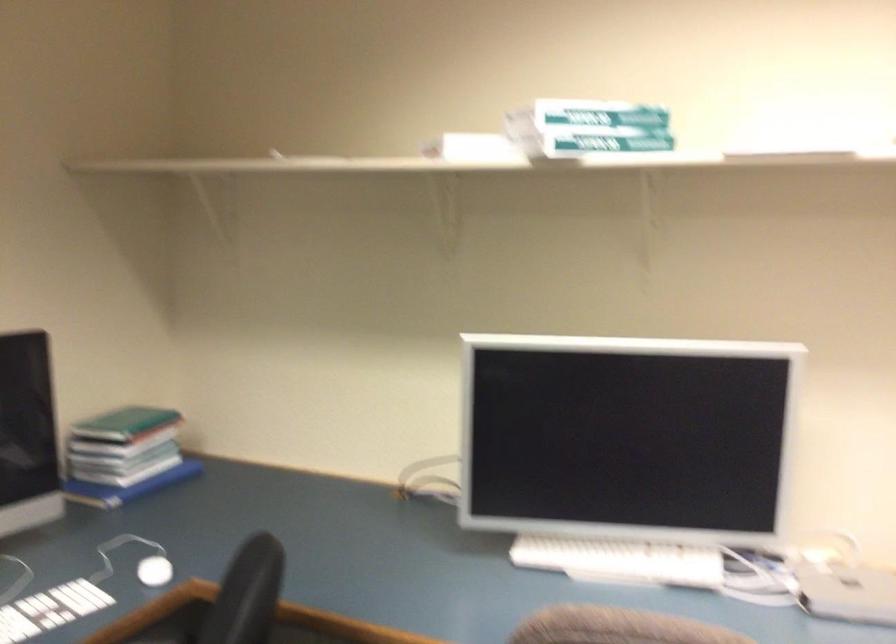
You are a GUI agent. You are given a task and a screenshot of the screen. Output one action in this format:
    pyautogui.click(x=<x>, y=<y>)
    Task: Click on the green book
    
    Given the screenshot: What is the action you would take?
    pyautogui.click(x=124, y=422)